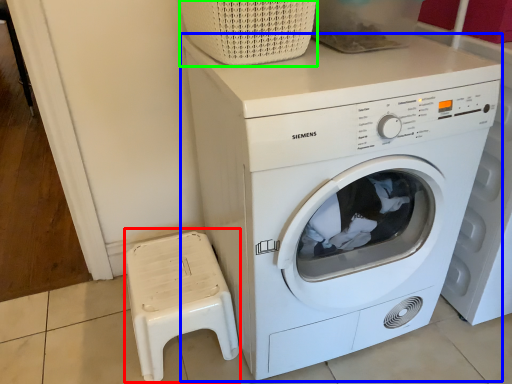
Question: Considering the real-world distances, which object is closest to music stool (highlighted by a red box)? washing machine (highlighted by a blue box) or basket (highlighted by a green box).

Choices:
 (A) washing machine
 (B) basket

Answer: (A)